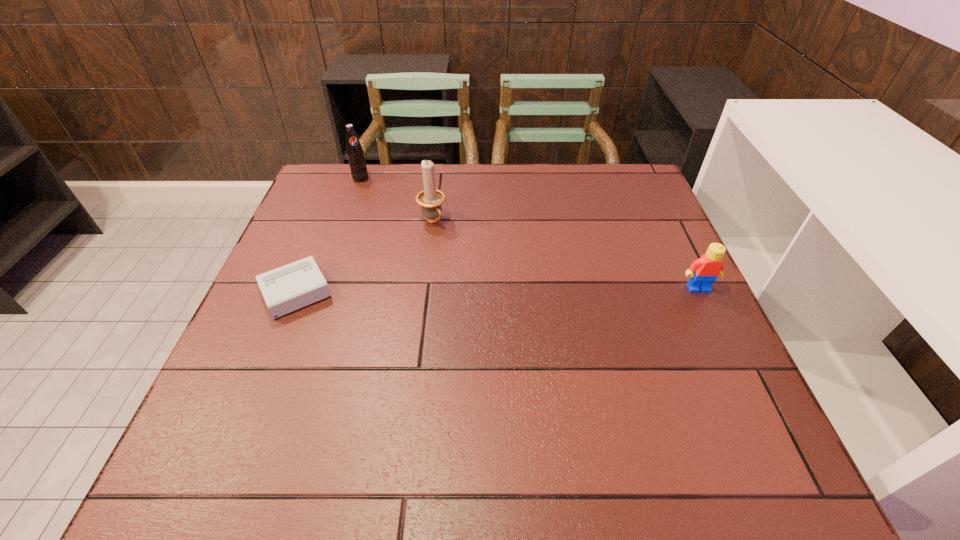
The width and height of the screenshot is (960, 540). I want to click on free spot located on the front label of the farthest object, so click(x=389, y=211).

Image resolution: width=960 pixels, height=540 pixels. I want to click on free space located 0.210m on the handle side of the second object from right to left, so click(477, 281).

Locate an element on the screen. free space located on the handle side of the second object from right to left is located at coordinates (521, 338).

What are the coordinates of `vacant space located 0.260m on the handle side of the second object from right to left` in the screenshot? It's located at (488, 294).

You are a GUI agent. You are given a task and a screenshot of the screen. Output one action in this format:
    pyautogui.click(x=<x>, y=<y>)
    Task: Click on the object that is at the far edge
    The image size is (960, 540).
    Given the screenshot: What is the action you would take?
    pyautogui.click(x=355, y=154)

Locate an element on the screen. alarm clock situated at the left edge is located at coordinates (288, 288).

At what (x,y) coordinates should I click in order to perform the action: click on pop at the left edge. Please return your answer as a coordinate pair (x, y). Image resolution: width=960 pixels, height=540 pixels. Looking at the image, I should click on (355, 154).

This screenshot has height=540, width=960. Identify the location of object located in the right edge section of the desktop. (703, 272).

Image resolution: width=960 pixels, height=540 pixels. I want to click on object located at the far left corner, so click(x=355, y=154).

Where is `free space at the far edge`? Image resolution: width=960 pixels, height=540 pixels. free space at the far edge is located at coordinates (575, 167).